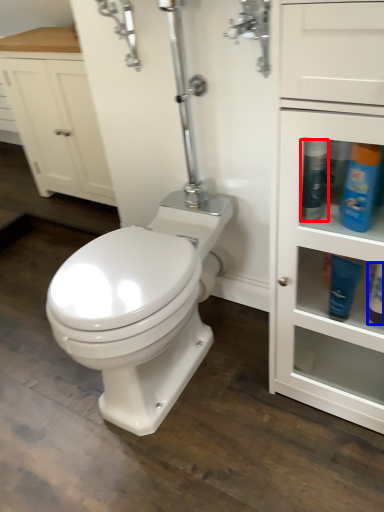
Question: Which object appears closest to the camera in this image, cleaning product (highlighted by a red box) or toiletry (highlighted by a blue box)?

Choices:
 (A) cleaning product
 (B) toiletry

Answer: (A)